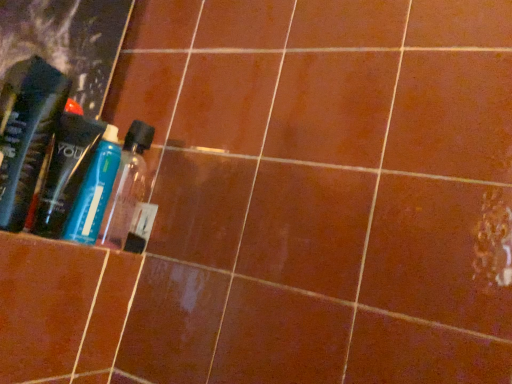
Question: Is transparent plastic bottle at center, the second bottle positioned from the front, inside or outside of translucent plastic bottle at left?

Choices:
 (A) inside
 (B) outside

Answer: (B)

Question: Is point (97, 206) closer or farther from the camera than point (18, 193)?

Choices:
 (A) closer
 (B) farther

Answer: (B)

Question: Which is farther from the translucent plastic bottle at left, marked as the second bottle in a back-to-front arrangement?

Choices:
 (A) translucent plastic bottle at left
 (B) transparent plastic bottle at center, the second bottle positioned from the front

Answer: (B)

Question: Which of these objects is positioned farthest from the translucent plastic bottle at left, marked as the second bottle in a back-to-front arrangement?

Choices:
 (A) translucent plastic bottle at left
 (B) transparent plastic bottle at center, the second bottle positioned from the front

Answer: (B)